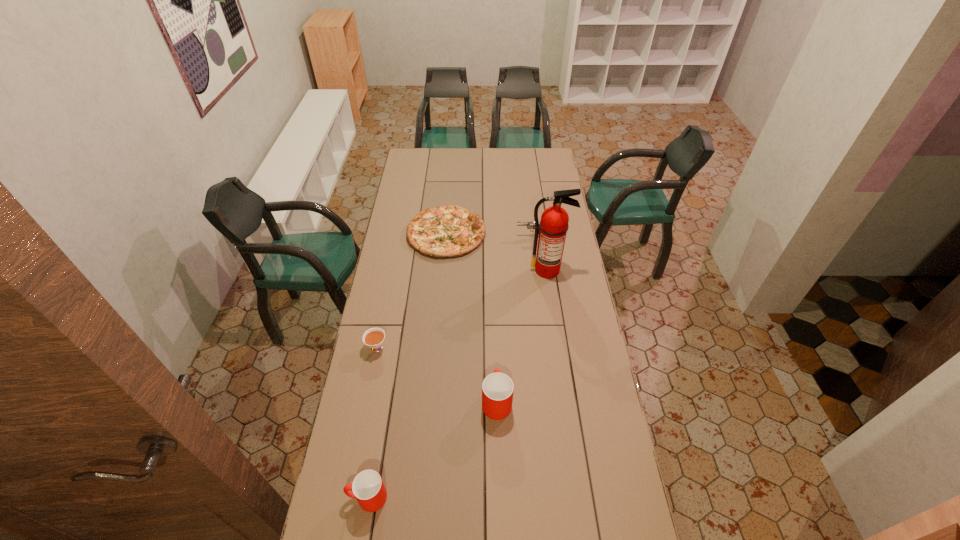
This screenshot has height=540, width=960. In order to click on the nearer cup in this screenshot , I will do `click(368, 488)`.

Identify the location of the left cup. This screenshot has width=960, height=540. (368, 488).

Find the location of `the fifth farthest object`. the fifth farthest object is located at coordinates [x=497, y=388].

Identify the location of the right cup. The width and height of the screenshot is (960, 540). (497, 388).

At what (x,y) coordinates should I click in order to perform the action: click on the third shortest object. Please return your answer as a coordinate pair (x, y). Image resolution: width=960 pixels, height=540 pixels. Looking at the image, I should click on (530, 225).

In order to click on the fourth farthest object in this screenshot , I will do `click(374, 337)`.

Locate an element on the screen. Image resolution: width=960 pixels, height=540 pixels. the second shortest object is located at coordinates (374, 337).

Identify the location of the third farthest object. (553, 226).

I want to click on the tallest object, so click(553, 226).

The image size is (960, 540). I want to click on pizza, so click(x=447, y=231).